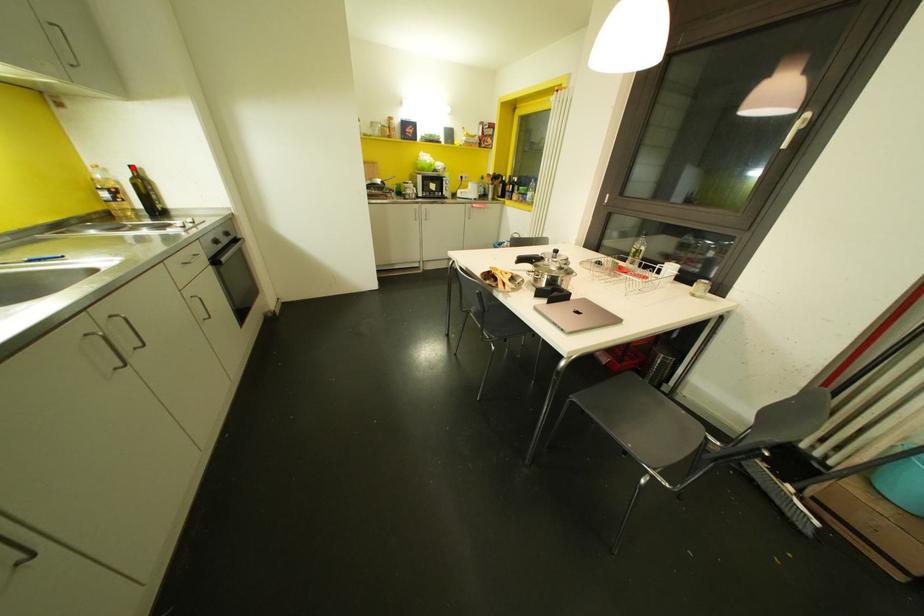
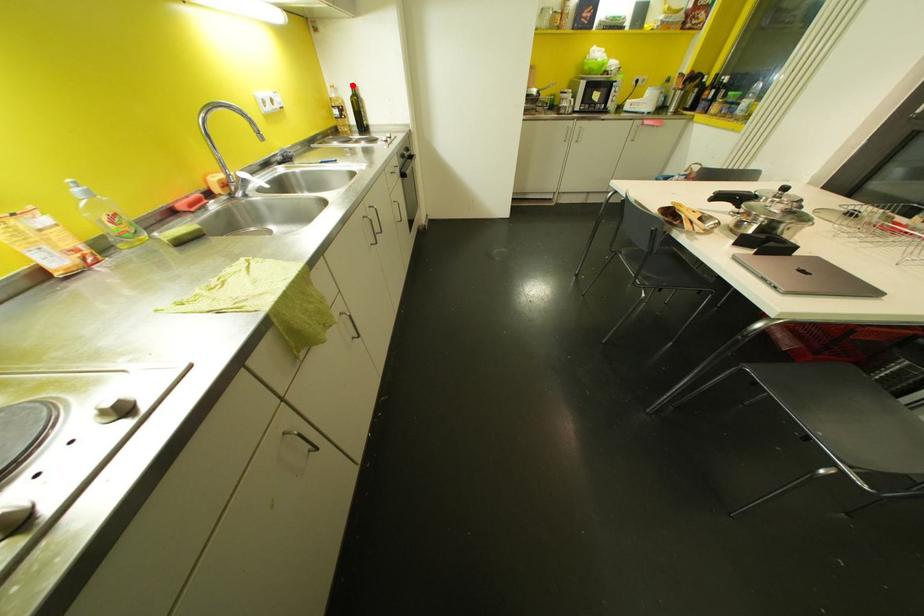
I am providing you with two images of the same scene from different viewpoints. A red point is marked on the first image and another point is marked on the second image. Do the highlighted points in image1 and image2 indicate the same real-world spot?

Yes